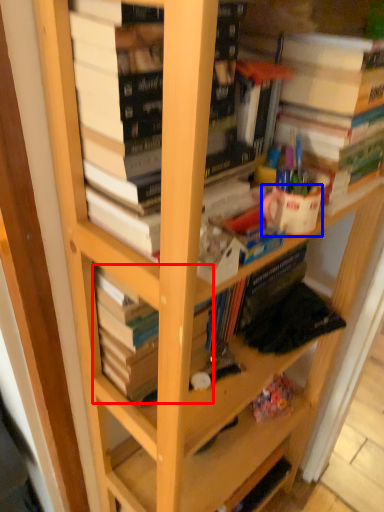
Question: Which object is further to the camera taking this photo, book (highlighted by a red box) or coffee cup (highlighted by a blue box)?

Choices:
 (A) book
 (B) coffee cup

Answer: (B)